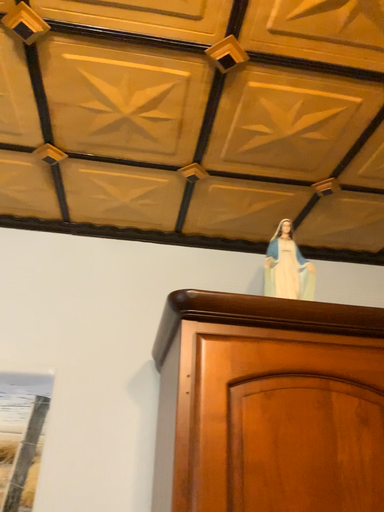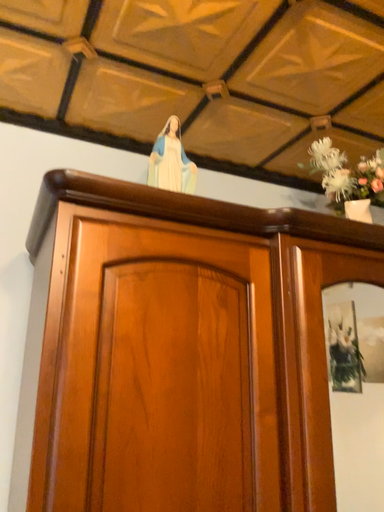
Question: How did the camera likely rotate when shooting the video?

Choices:
 (A) rotated upward
 (B) rotated downward

Answer: (B)